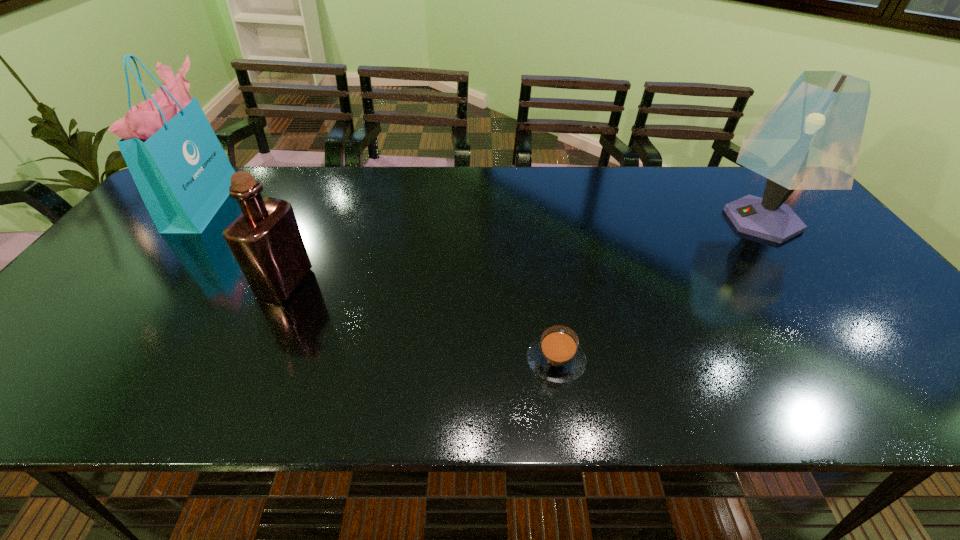
You are a GUI agent. You are given a task and a screenshot of the screen. Output one action in this format:
    pyautogui.click(x=<x>, y=<y>)
    Task: Click on the blank area located 0.280m on the back of the second shortest object
    The image size is (960, 540).
    Given the screenshot: What is the action you would take?
    pyautogui.click(x=322, y=200)

Image resolution: width=960 pixels, height=540 pixels. In order to click on free space located on the back of the shortest object in this screenshot , I will do `click(539, 240)`.

Where is `shopping bag that is at the far edge`? Image resolution: width=960 pixels, height=540 pixels. shopping bag that is at the far edge is located at coordinates (182, 173).

Identify the location of lampshade located in the far edge section of the desktop. The height and width of the screenshot is (540, 960). (810, 139).

Where is `object present at the near edge`? This screenshot has height=540, width=960. object present at the near edge is located at coordinates (556, 356).

The height and width of the screenshot is (540, 960). I want to click on object present at the left edge, so click(x=182, y=173).

You are a GUI agent. You are given a task and a screenshot of the screen. Output one action in this format:
    pyautogui.click(x=<x>, y=<y>)
    Task: Click on the object at the right edge
    This screenshot has width=960, height=540.
    Given the screenshot: What is the action you would take?
    pyautogui.click(x=810, y=139)

I want to click on object present at the far left corner, so click(182, 173).

This screenshot has width=960, height=540. Find the location of `object that is at the far right corner`. object that is at the far right corner is located at coordinates (810, 139).

The height and width of the screenshot is (540, 960). I want to click on free spot at the far edge of the desktop, so click(x=323, y=208).